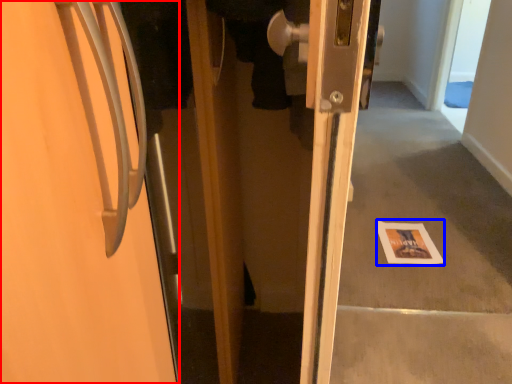
Question: Which of the following is the closest to the observer, door (highlighted by a red box) or postcard (highlighted by a blue box)?

Choices:
 (A) door
 (B) postcard

Answer: (A)